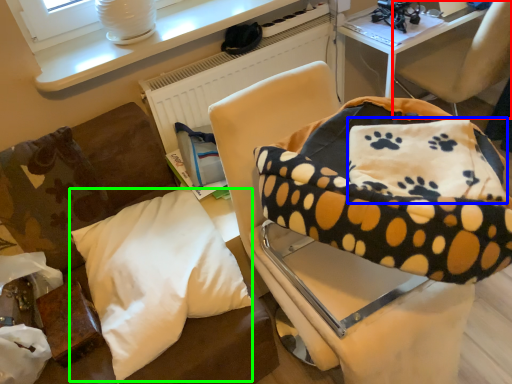
Question: Which object is the closest to the chair (highlighted by a red box)? Choose among these: pillow (highlighted by a blue box) or pillow (highlighted by a green box).

Choices:
 (A) pillow
 (B) pillow

Answer: (A)